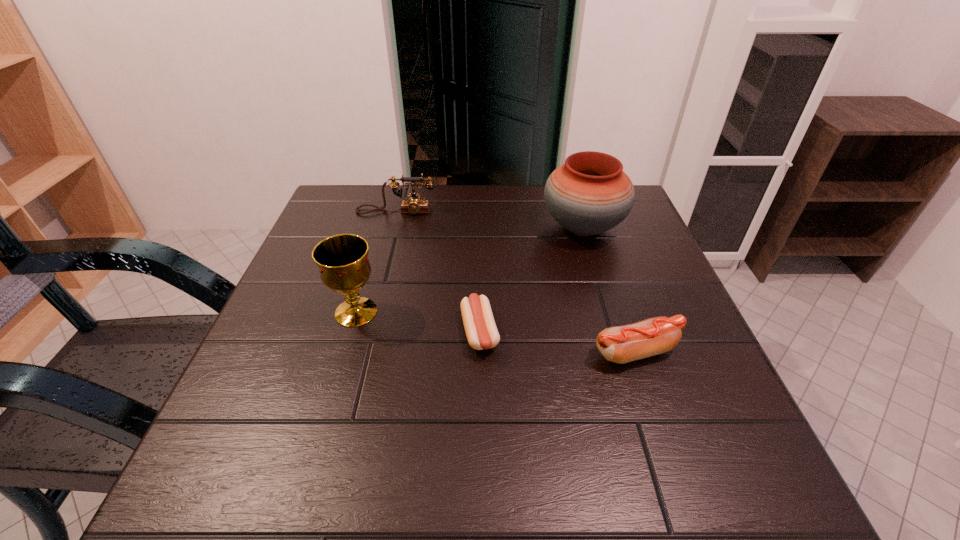
The height and width of the screenshot is (540, 960). I want to click on pottery, so pyautogui.click(x=590, y=194).

Locate an element on the screen. This screenshot has width=960, height=540. chalice is located at coordinates (343, 261).

Where is `telephone`? The image size is (960, 540). telephone is located at coordinates (414, 205).

Where is `the second shortest object`? This screenshot has height=540, width=960. the second shortest object is located at coordinates (622, 344).

The image size is (960, 540). What are the coordinates of `the right sausage` in the screenshot? It's located at (622, 344).

This screenshot has height=540, width=960. I want to click on the shortest object, so click(x=481, y=331).

I want to click on the shorter sausage, so click(x=481, y=331).

In order to click on free space located on the front of the pottery in this screenshot , I will do `click(626, 369)`.

Locate an element on the screen. The height and width of the screenshot is (540, 960). blank space located on the right of the chalice is located at coordinates (479, 312).

The width and height of the screenshot is (960, 540). I want to click on vacant space located 0.060m on the front-facing side of the third tallest object, so click(x=392, y=230).